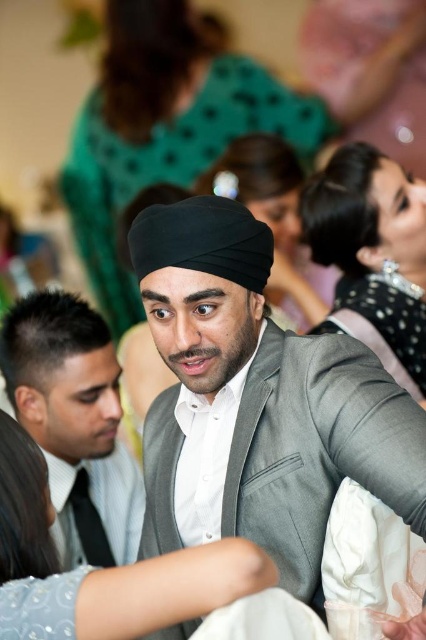
Who is positioned more to the left, matte black turban at center or matte gray suit at center?

matte gray suit at center is more to the left.

Is point (327, 392) farther from viewer compared to point (100, 349)?

No.

Between point (288, 410) and point (45, 413), which one is positioned behind?

Point (45, 413)

I want to click on matte black turban at center, so click(258, 401).